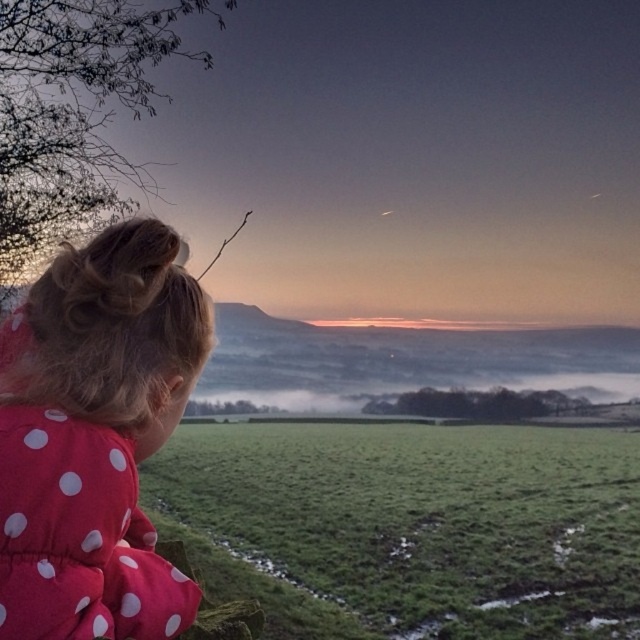
Question: Is green grassy field at lower center to the right of polka dot fabric at left from the viewer's perspective?

Choices:
 (A) yes
 (B) no

Answer: (A)

Question: Does green grassy field at lower center lie in front of polka dot fabric at left?

Choices:
 (A) no
 (B) yes

Answer: (A)

Question: Is green grassy field at lower center further to camera compared to polka dot fabric at left?

Choices:
 (A) no
 (B) yes

Answer: (B)

Question: Which point is farther to the camera?

Choices:
 (A) polka dot fabric at left
 (B) green grassy field at lower center

Answer: (B)

Question: Which object appears closest to the camera in this image?

Choices:
 (A) green grassy field at lower center
 (B) polka dot fabric at left

Answer: (B)